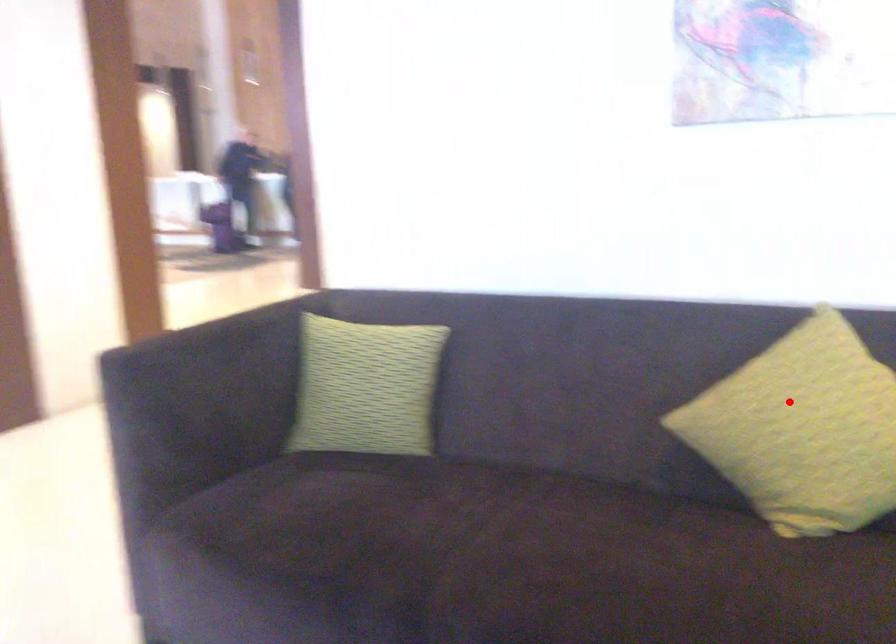
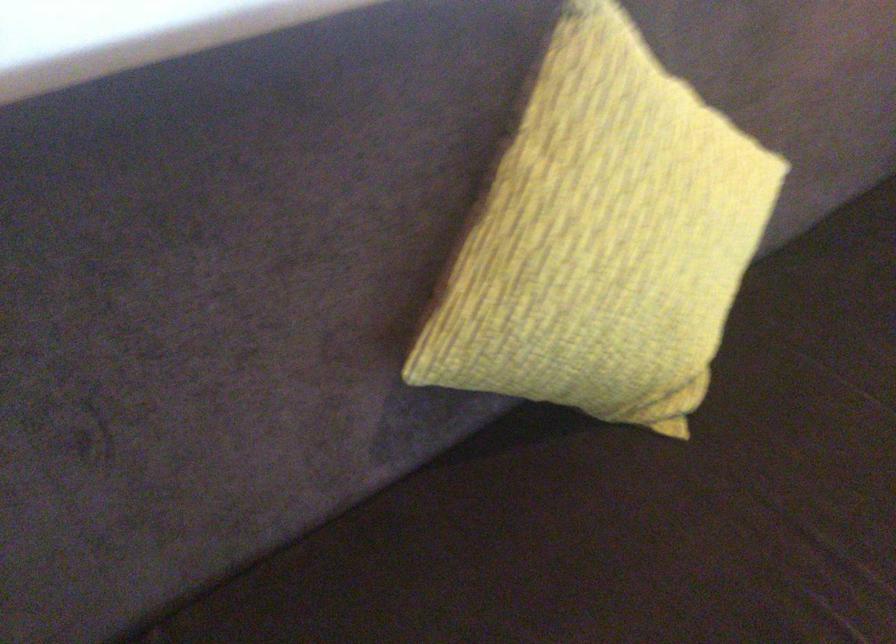
Question: A red point is marked in image1. In image2, is the corresponding 3D point closer to the camera or farther? Reply with the corresponding letter.

Choices:
 (A) The corresponding 3D point is closer.
 (B) The corresponding 3D point is farther.

Answer: (A)